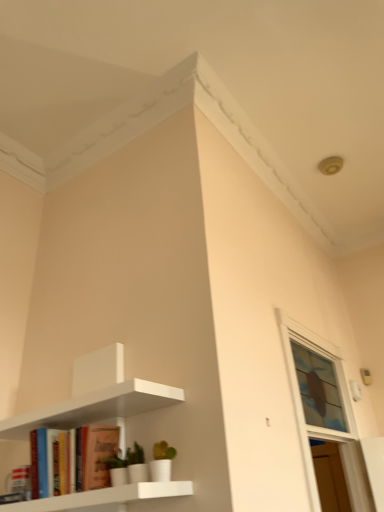
What is the approximate height of matte orange book at lower left?

matte orange book at lower left is 8.07 inches in height.

The image size is (384, 512). Describe the element at coordinates (95, 408) in the screenshot. I see `white matte shelf at upper left` at that location.

At what (x,y) coordinates should I click in order to perform the action: click on clear glass window at upper right. Please return your answer as a coordinate pair (x, y). The width and height of the screenshot is (384, 512). Looking at the image, I should click on (321, 387).

How much distance is there between clear glass window at upper right and white matte shelf at upper left?

clear glass window at upper right is 3.72 feet from white matte shelf at upper left.

Is clear glass window at upper right inside or outside of white matte shelf at upper left?

clear glass window at upper right is not inside white matte shelf at upper left, it's outside.

Based on the photo, does clear glass window at upper right have a greater height compared to white matte shelf at upper left?

Incorrect, the height of clear glass window at upper right is not larger of that of white matte shelf at upper left.

Is clear glass window at upper right aimed at white matte shelf at upper left?

No, clear glass window at upper right is not oriented towards white matte shelf at upper left.

From a real-world perspective, between white matte shelf at upper left and clear glass window at upper right, who is vertically lower?

From a 3D spatial view, white matte shelf at upper left is below.

In the scene shown: Is white matte shelf at upper left oriented away from clear glass window at upper right?

Yes.

Are white matte shelf at upper left and clear glass window at upper right making contact?

white matte shelf at upper left is not next to clear glass window at upper right, and they're not touching.

Can you confirm if white matte shelf at upper left is thinner than clear glass window at upper right?

In fact, white matte shelf at upper left might be wider than clear glass window at upper right.

From a real-world perspective, which object rests below the other?

matte orange book at lower left is physically lower.

Which is more to the left, matte orange book at lower left or clear glass window at upper right?

matte orange book at lower left.

Which is behind, point (116, 446) or point (297, 374)?

Point (297, 374)

Is matte orange book at lower left facing away from clear glass window at upper right?

That's right, matte orange book at lower left is facing away from clear glass window at upper right.

Is clear glass window at upper right facing towards matte orange book at lower left?

No, clear glass window at upper right does not turn towards matte orange book at lower left.

Is point (334, 371) in front of point (101, 437)?

No, (334, 371) is further to viewer.

You are a GUI agent. You are given a task and a screenshot of the screen. Output one action in this format:
    pyautogui.click(x=<x>, y=<y>)
    Task: Click on the book to the left of clear glass window at upper right
    
    Given the screenshot: What is the action you would take?
    pyautogui.click(x=95, y=455)

From the image's perspective, is clear glass window at upper right over matte orange book at lower left?

Yes, from the image's perspective, clear glass window at upper right is over matte orange book at lower left.

Is matte orange book at lower left thinner than white matte shelf at upper left?

Yes, matte orange book at lower left is thinner than white matte shelf at upper left.

Who is shorter, matte orange book at lower left or white matte shelf at upper left?

matte orange book at lower left.

Is matte orange book at lower left facing away from white matte shelf at upper left?

That's right, matte orange book at lower left is facing away from white matte shelf at upper left.

Does matte orange book at lower left appear on the left side of white matte shelf at upper left?

No.

Can you confirm if white matte shelf at upper left is wider than matte orange book at lower left?

Correct, the width of white matte shelf at upper left exceeds that of matte orange book at lower left.

Is white matte shelf at upper left turned away from matte orange book at lower left?

Yes, white matte shelf at upper left's orientation is away from matte orange book at lower left.

Is white matte shelf at upper left at the right side of matte orange book at lower left?

Incorrect, white matte shelf at upper left is not on the right side of matte orange book at lower left.

Where is `window above the white matte shelf at upper left (from a real-world perspective)`? This screenshot has width=384, height=512. window above the white matte shelf at upper left (from a real-world perspective) is located at coordinates (321, 387).

Locate an element on the screen. The height and width of the screenshot is (512, 384). shelf that appears above the clear glass window at upper right (from the image's perspective) is located at coordinates (95, 408).

Which object lies further to the anchor point white matte shelf at upper left, matte orange book at lower left or clear glass window at upper right?

clear glass window at upper right is further to white matte shelf at upper left.

Looking at the image, which one is located closer to clear glass window at upper right, white matte shelf at upper left or matte orange book at lower left?

The object closer to clear glass window at upper right is white matte shelf at upper left.

When comparing their distances from matte orange book at lower left, does white matte shelf at upper left or clear glass window at upper right seem further?

clear glass window at upper right.

Estimate the real-world distances between objects in this image. Which object is closer to white matte shelf at upper left, clear glass window at upper right or matte orange book at lower left?

matte orange book at lower left is closer to white matte shelf at upper left.

From the image, which object appears to be nearer to clear glass window at upper right, matte orange book at lower left or white matte shelf at upper left?

The object closer to clear glass window at upper right is white matte shelf at upper left.

Based on their spatial positions, is clear glass window at upper right or white matte shelf at upper left closer to matte orange book at lower left?

white matte shelf at upper left.

Identify the location of book between white matte shelf at upper left and clear glass window at upper right from left to right. (95, 455).